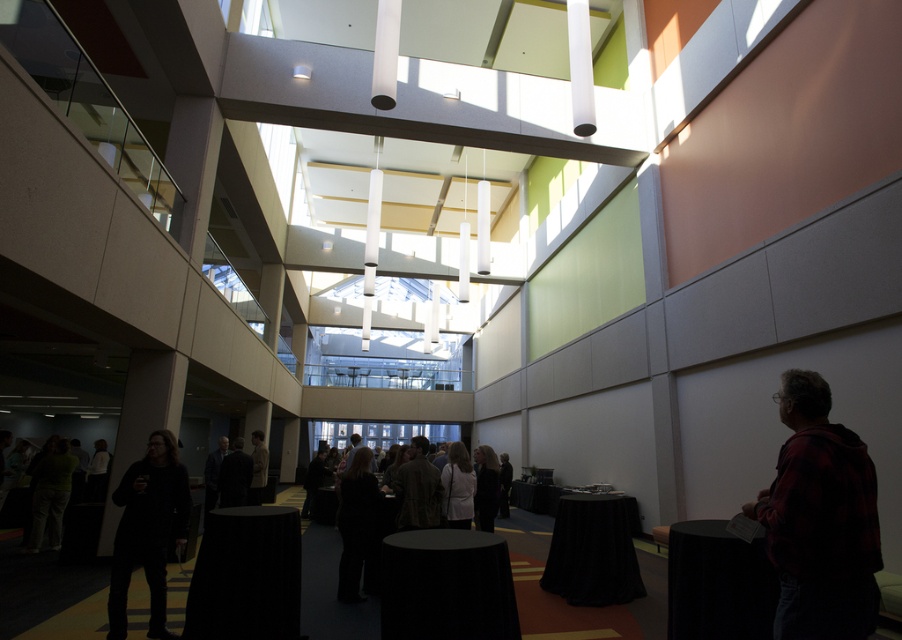
You are standing in the atrium and see both the dark gray pants at center and the dark gray sweater at center. Which item is closer to you?

The dark gray pants at center are closer to you than the dark gray sweater at center.

You are organizing a charity event and need to decide which dark gray sweater to donate. Both the dark gray sweater at lower left and the dark gray sweater at center are available. Which one should you choose if you want to donate the larger one?

The dark gray sweater at lower left is larger than the dark gray sweater at center, so you should choose the dark gray sweater at lower left for donation.

You are an interior designer planning to place a decorative pillow between the dark gray pants at center and the dark gray sweater at center. Which object should the pillow be placed closer to if you want it to be near the larger one?

The dark gray pants at center is larger than the dark gray sweater at center, so the decorative pillow should be placed closer to the dark gray pants at center.